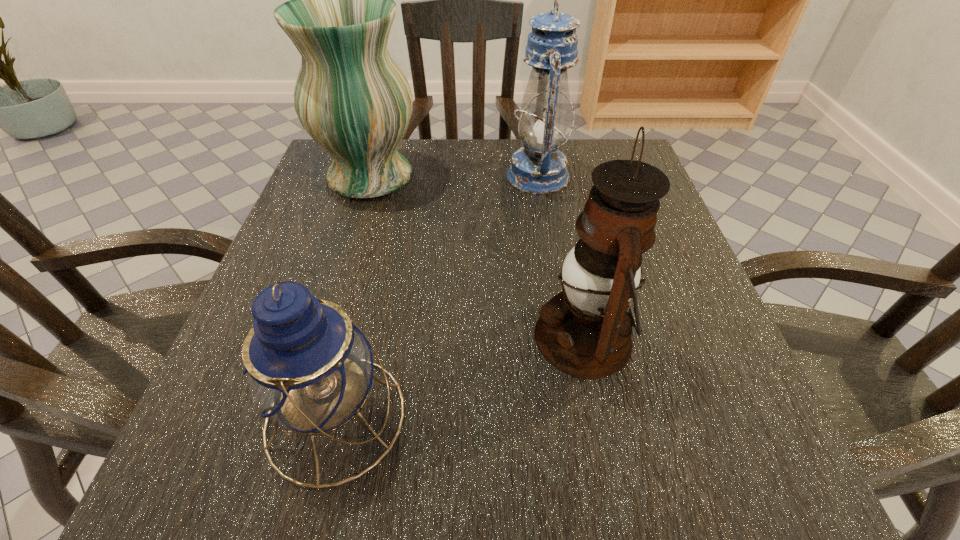
You are a GUI agent. You are given a task and a screenshot of the screen. Output one action in this format:
    pyautogui.click(x=<x>, y=<y>)
    Task: Click on the farthest lantern
    Image resolution: width=960 pixels, height=540 pixels.
    Given the screenshot: What is the action you would take?
    pyautogui.click(x=539, y=168)

You are a GUI agent. You are given a task and a screenshot of the screen. Output one action in this format:
    pyautogui.click(x=<x>, y=<y>)
    Task: Click on the vase
    The image size is (960, 540).
    Given the screenshot: What is the action you would take?
    (351, 97)

Identify the location of the shortest object. (309, 367).

The width and height of the screenshot is (960, 540). Find the location of `the leftmost lantern`. the leftmost lantern is located at coordinates pos(309,367).

Locate an element on the screen. vacant space located 0.320m on the front-facing side of the farthest lantern is located at coordinates (363, 176).

I want to click on vacant area situated on the front-facing side of the farthest lantern, so click(407, 176).

Locate an element on the screen. This screenshot has height=540, width=960. free space located 0.080m on the front-facing side of the farthest lantern is located at coordinates (470, 176).

At what (x,y) coordinates should I click in order to perform the action: click on free space located 0.400m on the front of the vase. Please return your answer as a coordinate pair (x, y). Looking at the image, I should click on (308, 377).

The height and width of the screenshot is (540, 960). What are the coordinates of `free space located 0.060m on the front-facing side of the leftmost lantern` in the screenshot? It's located at (449, 417).

Image resolution: width=960 pixels, height=540 pixels. Identify the location of lantern present at the far edge. (539, 168).